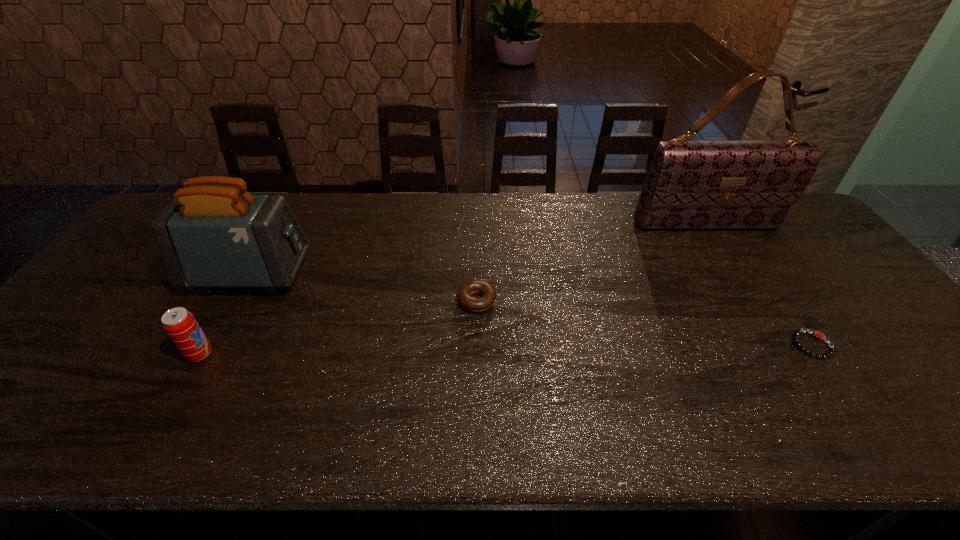
What are the coordinates of `empty space between the bracelet and the third tallest object` in the screenshot? It's located at (506, 350).

Where is `vacant point located between the toaster and the farthest object`? The width and height of the screenshot is (960, 540). vacant point located between the toaster and the farthest object is located at coordinates (478, 250).

At what (x,y) coordinates should I click in order to perform the action: click on vacant point located between the soda can and the bracelet. Please return your answer as a coordinate pair (x, y). This screenshot has width=960, height=540. Looking at the image, I should click on (506, 350).

The width and height of the screenshot is (960, 540). What are the coordinates of `free spot between the third object from left to right and the third shortest object` in the screenshot? It's located at (x=339, y=328).

The image size is (960, 540). In order to click on free space between the second tallest object and the handbag in this screenshot , I will do `click(478, 250)`.

Where is `vacant point located between the doughnut and the toaster`? The height and width of the screenshot is (540, 960). vacant point located between the doughnut and the toaster is located at coordinates coord(364,288).

Where is `free space between the fourth tallest object and the fourth shortest object`? The height and width of the screenshot is (540, 960). free space between the fourth tallest object and the fourth shortest object is located at coordinates (364, 288).

In order to click on vacant area between the toaster and the third shortest object in this screenshot , I will do `click(226, 315)`.

You are a GUI agent. You are given a task and a screenshot of the screen. Output one action in this format:
    pyautogui.click(x=<x>, y=<y>)
    Task: Click on the vacant area that lies between the doughnut and the bracelet
    
    Given the screenshot: What is the action you would take?
    pyautogui.click(x=644, y=323)

The width and height of the screenshot is (960, 540). I want to click on free space between the shortest object and the third tallest object, so click(x=506, y=350).